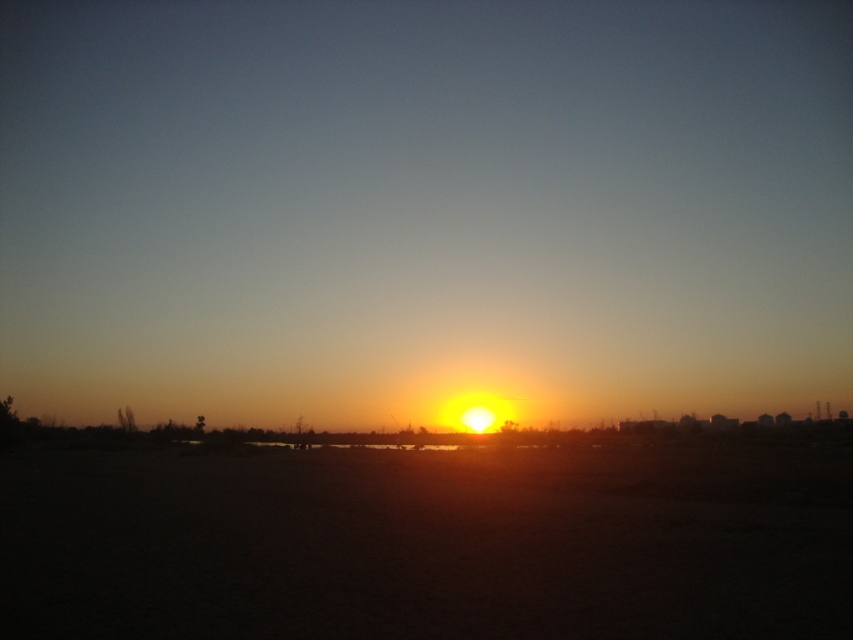
Which is behind, point (511, 208) or point (543, 545)?

Point (511, 208)

Is yellow-orange sky at center shorter than smooth sand beach at center?

Incorrect, yellow-orange sky at center's height does not fall short of smooth sand beach at center's.

Does point (550, 253) come behind point (64, 500)?

Yes, point (550, 253) is farther from viewer.

You are a GUI agent. You are given a task and a screenshot of the screen. Output one action in this format:
    pyautogui.click(x=<x>, y=<y>)
    Task: Click on the yellow-orange sky at center
    
    Given the screenshot: What is the action you would take?
    pyautogui.click(x=424, y=209)